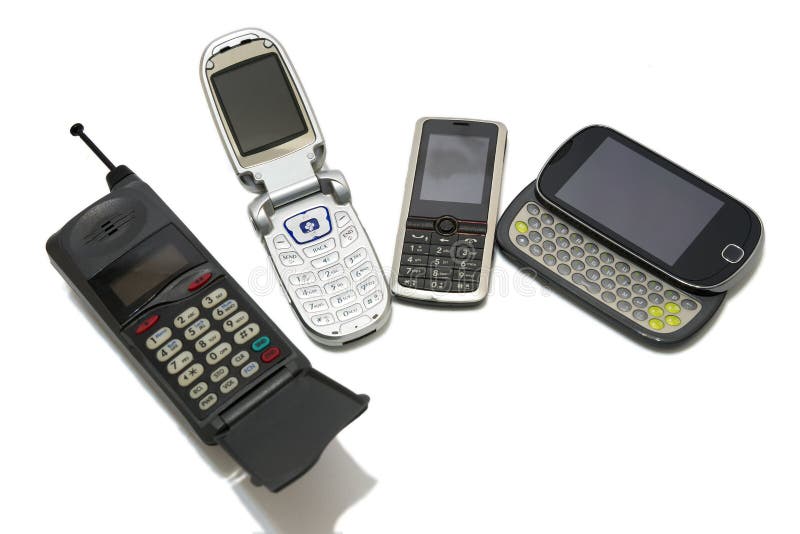
The image size is (800, 534). I want to click on phones, so click(x=224, y=347), click(x=330, y=281), click(x=434, y=252), click(x=584, y=260).